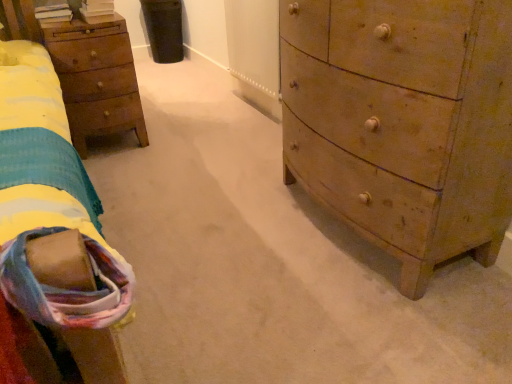
Locate an element on the screen. soft cotton blanket at lower left is located at coordinates [x=51, y=230].

At what (x,y) coordinates should I click in order to perform the action: click on soft cotton blanket at lower left. Please return your answer as a coordinate pair (x, y). This screenshot has height=384, width=512. Looking at the image, I should click on (51, 230).

Is wooden chest of drawers at right looking in the opposite direction of soft cotton blanket at lower left?

No, wooden chest of drawers at right's orientation is not away from soft cotton blanket at lower left.

From the image's perspective, who appears lower, wooden chest of drawers at right or soft cotton blanket at lower left?

soft cotton blanket at lower left is shown below in the image.

Measure the distance between wooden chest of drawers at right and soft cotton blanket at lower left.

They are 36.29 inches apart.

Where is `bed above the wooden chest of drawers at right (from a real-world perspective)`? The width and height of the screenshot is (512, 384). bed above the wooden chest of drawers at right (from a real-world perspective) is located at coordinates (51, 230).

Based on the photo, from a real-world perspective, is wooden nightstand at left located higher than wooden chest of drawers at right?

No, from a real-world perspective, wooden nightstand at left is not over wooden chest of drawers at right

From the picture: Can wooden chest of drawers at right be found inside wooden nightstand at left?

Definitely not — wooden chest of drawers at right is not inside wooden nightstand at left.

From the image's perspective, is wooden nightstand at left located above or below wooden chest of drawers at right?

From the image's perspective, wooden nightstand at left appears above wooden chest of drawers at right.

Which is behind, point (119, 29) or point (330, 18)?

The point (119, 29) is behind.

Identify the location of bed above the wooden chest of drawers at right (from a real-world perspective). (51, 230).

Can you see soft cotton blanket at lower left touching wooden chest of drawers at right?

No, soft cotton blanket at lower left is not touching wooden chest of drawers at right.

Does soft cotton blanket at lower left turn towards wooden chest of drawers at right?

No.

From the image's perspective, is wooden nightstand at left located above or below soft cotton blanket at lower left?

Clearly, from the image's perspective, wooden nightstand at left is above soft cotton blanket at lower left.

Is wooden nightstand at left at the left side of soft cotton blanket at lower left?

Yes, wooden nightstand at left is to the left of soft cotton blanket at lower left.

Measure the distance between wooden nightstand at left and soft cotton blanket at lower left.

They are 23.75 inches apart.

Which object is wider, wooden chest of drawers at right or wooden nightstand at left?

wooden chest of drawers at right.

Can you confirm if wooden chest of drawers at right is shorter than wooden nightstand at left?

No, wooden chest of drawers at right is not shorter than wooden nightstand at left.

From the image's perspective, between wooden chest of drawers at right and wooden nightstand at left, who is located below?

From the image's view, wooden chest of drawers at right is below.

Could you tell me if wooden chest of drawers at right is turned towards wooden nightstand at left?

No, wooden chest of drawers at right is not aimed at wooden nightstand at left.

From a real-world perspective, which is physically above, soft cotton blanket at lower left or wooden nightstand at left?

soft cotton blanket at lower left is physically above.

Does point (39, 189) come in front of point (68, 79)?

That is True.

Who is shorter, soft cotton blanket at lower left or wooden nightstand at left?

soft cotton blanket at lower left is shorter.

Which object is wider, soft cotton blanket at lower left or wooden nightstand at left?

wooden nightstand at left is wider.

Identify the location of bed that is on the left side of wooden chest of drawers at right. (51, 230).

Image resolution: width=512 pixels, height=384 pixels. What are the coordinates of `the chest of drawers lying in front of the wooden nightstand at left` in the screenshot? It's located at (403, 122).

From the image, which object appears to be nearer to wooden chest of drawers at right, soft cotton blanket at lower left or wooden nightstand at left?

soft cotton blanket at lower left lies closer to wooden chest of drawers at right than the other object.

When comparing their distances from soft cotton blanket at lower left, does wooden chest of drawers at right or wooden nightstand at left seem closer?

Based on the image, wooden nightstand at left appears to be nearer to soft cotton blanket at lower left.

In the scene shown: Which object lies further to the anchor point wooden nightstand at left, wooden chest of drawers at right or soft cotton blanket at lower left?

Among the two, wooden chest of drawers at right is located further to wooden nightstand at left.

From the image, which object appears to be nearer to soft cotton blanket at lower left, wooden nightstand at left or wooden chest of drawers at right?

The object closer to soft cotton blanket at lower left is wooden nightstand at left.

Looking at the image, which one is located further to wooden chest of drawers at right, wooden nightstand at left or soft cotton blanket at lower left?

Based on the image, wooden nightstand at left appears to be further to wooden chest of drawers at right.

Based on the photo, which object lies further to the anchor point wooden nightstand at left, soft cotton blanket at lower left or wooden chest of drawers at right?

wooden chest of drawers at right lies further to wooden nightstand at left than the other object.

What are the coordinates of `chest of drawers between soft cotton blanket at lower left and wooden nightstand at left along the z-axis` in the screenshot? It's located at (403, 122).